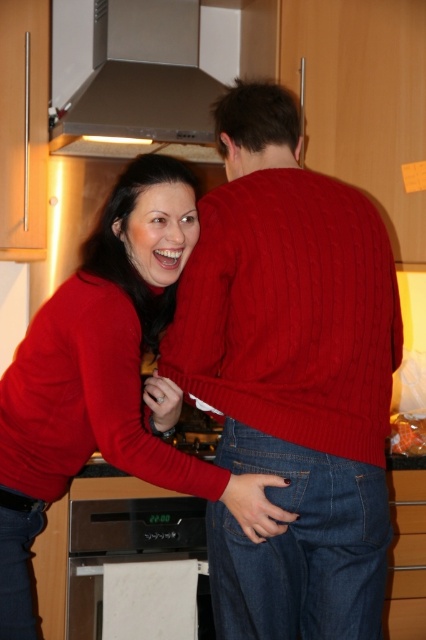
You are a photographer standing in the kitchen and want to take a photo of the matte red sweater at center and the black glossy oven at lower center. Which object will appear larger in the photo?

The matte red sweater at center will appear larger in the photo because it is closer to the viewer than the black glossy oven at lower center.

You are a home inspector evaluating the kitchen layout. You notice the satin silver exhaust hood at upper center and the black glossy oven at lower center. According to safety standards, the exhaust hood must be positioned directly above the oven. Does the current placement meet this requirement?

Yes, the satin silver exhaust hood at upper center is positioned above the black glossy oven at lower center, which aligns with the safety standard requiring the exhaust hood to be directly above the oven.